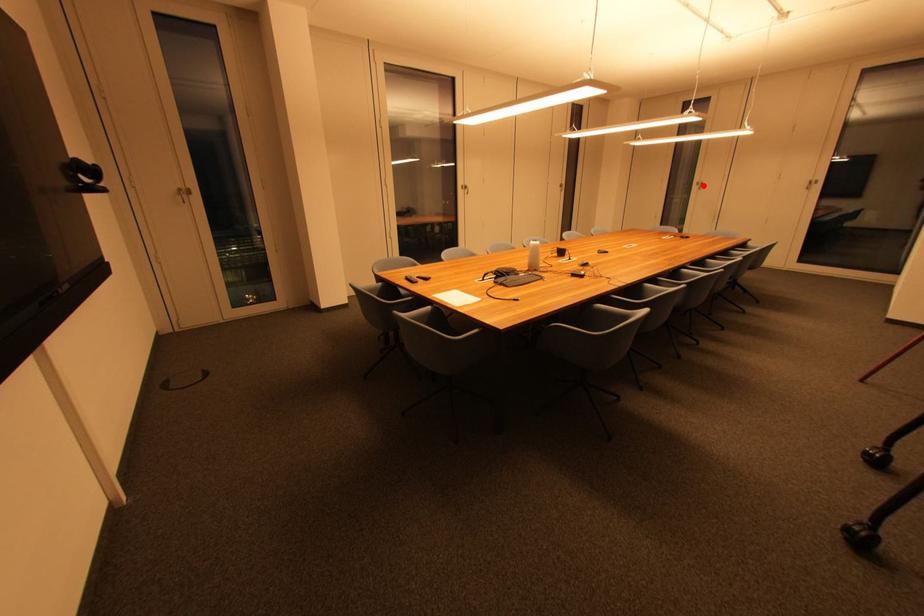
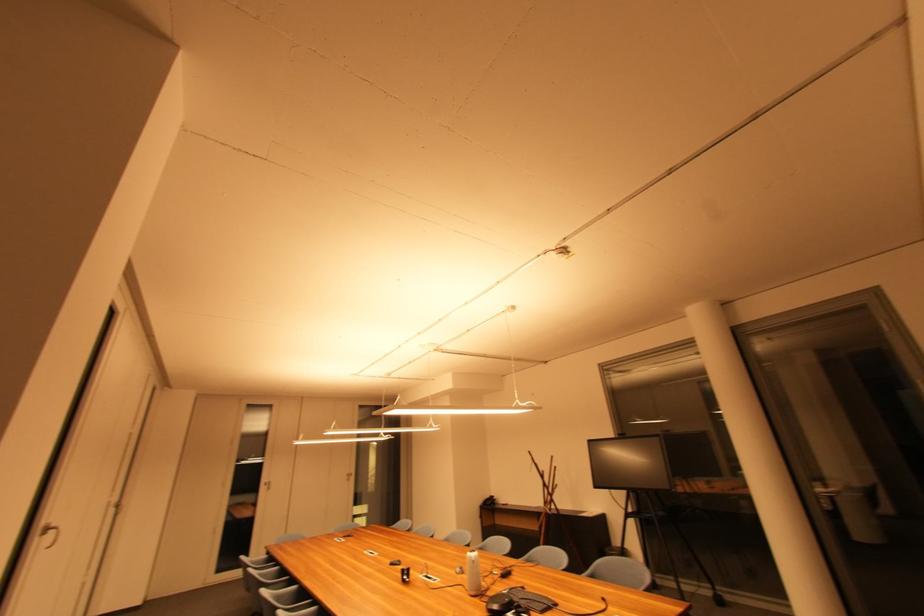
Find the pixel in the second image that matches the highlighted location in the first image.

(271, 485)